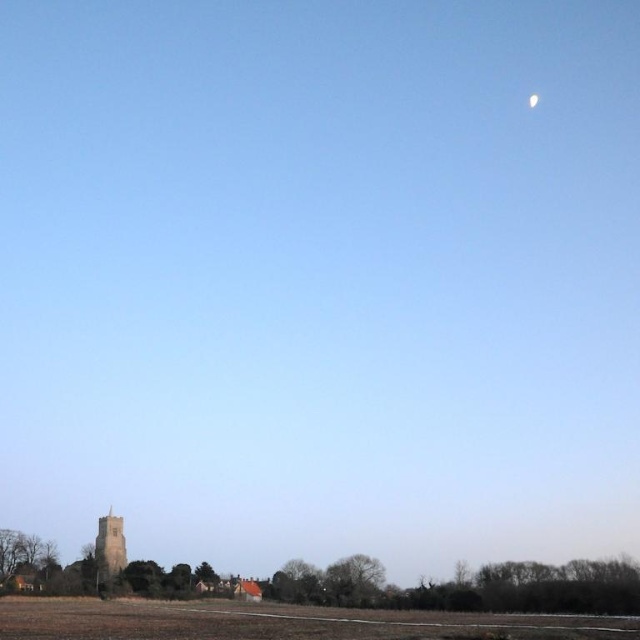
You are standing at the point marked by coordinates point (278, 621) in the image. What do you see directly in front of you?

The point (278, 621) is located at the brown grassy field at lower center, so you would see the brown grassy field at lower center directly in front of you.

Based on the photo, you are standing at the point marked by coordinates point [278,621] in the image. Looking around, what do you see immediately around you?

You are standing on the brown grassy field at lower center, as indicated by the point [278,621].

You are an astronaut who just landed on the moon. You see the brown grassy field at lower center and the white glossy moon at upper right. Which object is bigger in the image?

The brown grassy field at lower center is larger in size than the white glossy moon at upper right, so the brown grassy field at lower center is bigger in the image.